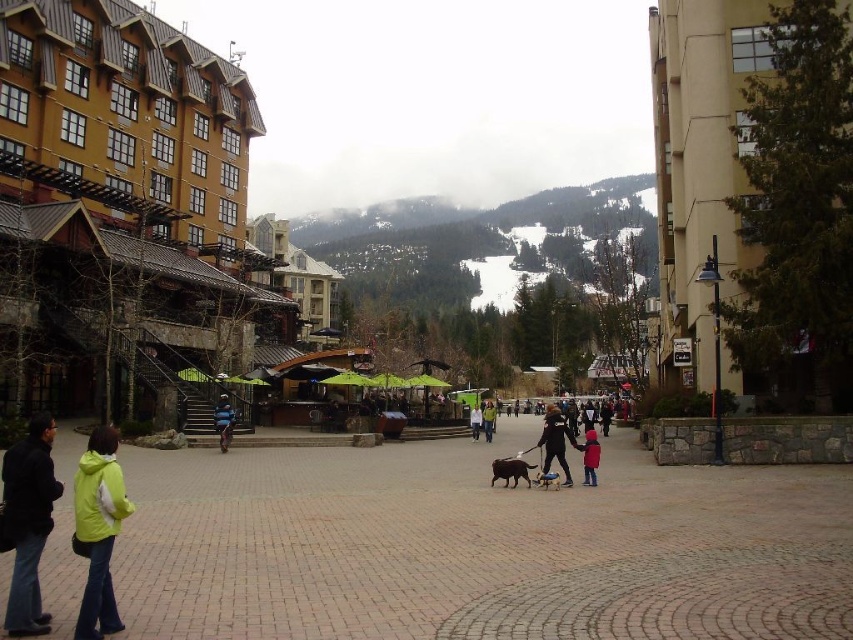
You are standing at point [479,547] in the ski resort town. What is the material under your feet?

The material under your feet at point [479,547] is brick pavement.